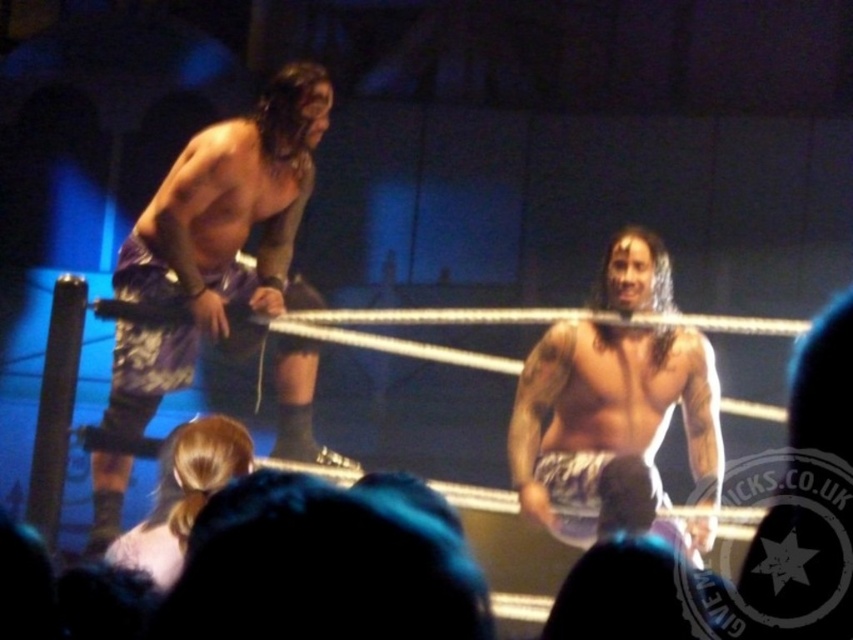
From the picture: Between purple fabric shorts at left and tattooed skin at center, which one is positioned higher?

purple fabric shorts at left

Does purple fabric shorts at left appear over tattooed skin at center?

Correct, purple fabric shorts at left is located above tattooed skin at center.

Who is more forward, [157,260] or [619,342]?

Positioned in front is point [157,260].

Where is `purple fabric shorts at left`? purple fabric shorts at left is located at coordinates (215, 240).

Does shiny metallic shorts at center have a lesser height compared to musclesmoothtorso at left?

No, shiny metallic shorts at center is not shorter than musclesmoothtorso at left.

Does shiny metallic shorts at center appear over musclesmoothtorso at left?

No.

Who is more forward, (550, 360) or (260, 256)?

Point (550, 360) is in front.

Locate an element on the screen. This screenshot has width=853, height=640. shiny metallic shorts at center is located at coordinates (613, 428).

Is shiny metallic shorts at center taller than tattooed skin at center?

Yes.

How much distance is there between shiny metallic shorts at center and tattooed skin at center?

The distance of shiny metallic shorts at center from tattooed skin at center is 2.76 inches.

Find the location of `shiny metallic shorts at center`. shiny metallic shorts at center is located at coordinates (613, 428).